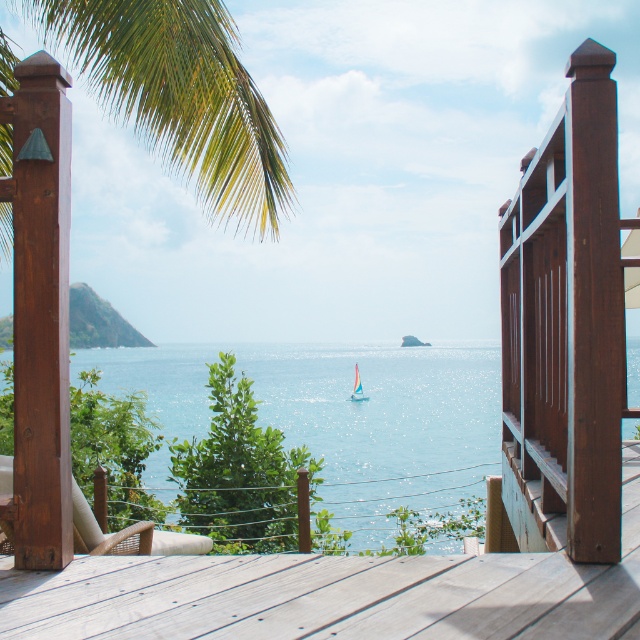
Measure the distance from wooden deck at center to pastel pink sailboat at center.

A distance of 13.77 meters exists between wooden deck at center and pastel pink sailboat at center.

Is wooden deck at center smaller than pastel pink sailboat at center?

No.

Where is `wooden deck at center`? The width and height of the screenshot is (640, 640). wooden deck at center is located at coordinates (333, 593).

Can you confirm if green leafy palm tree at upper left is wider than pastel pink sailboat at center?

No, green leafy palm tree at upper left is not wider than pastel pink sailboat at center.

Where is `green leafy palm tree at upper left`? This screenshot has height=640, width=640. green leafy palm tree at upper left is located at coordinates (179, 97).

Which is behind, point (20, 12) or point (356, 371)?

The point (356, 371) is more distant.

Where is `green leafy palm tree at upper left`? green leafy palm tree at upper left is located at coordinates (179, 97).

Which is below, wooden deck at center or blue water at center?

Positioned lower is blue water at center.

Locate an element on the screen. wooden deck at center is located at coordinates [333, 593].